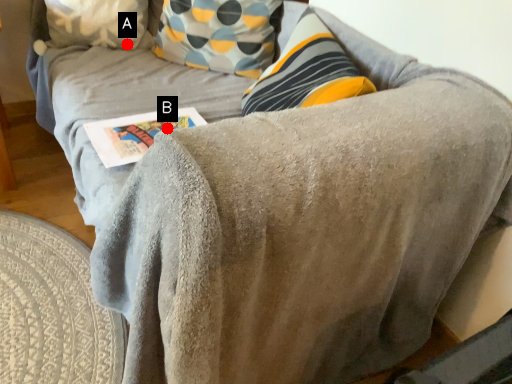
Question: Two points are circled on the image, labeled by A and B beside each circle. Which point is further to the camera?

Choices:
 (A) A is further
 (B) B is further

Answer: (A)